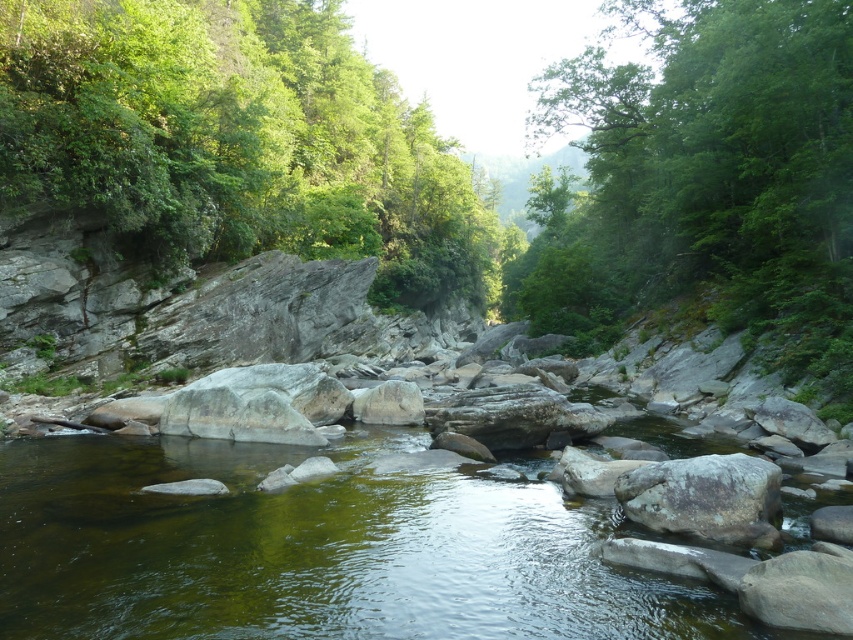
Question: Considering the real-world distances, which object is farthest from the green leafy tree at upper left?

Choices:
 (A) gray rough rock at center
 (B) green leafy tree at upper center

Answer: (A)

Question: Estimate the real-world distances between objects in this image. Which object is farther from the green leafy tree at upper left?

Choices:
 (A) green leafy tree at upper center
 (B) gray rough rock at center

Answer: (B)

Question: From the image, what is the correct spatial relationship of green leafy tree at upper left in relation to green leafy tree at upper center?

Choices:
 (A) left
 (B) right

Answer: (A)

Question: Which object appears closest to the camera in this image?

Choices:
 (A) green leafy tree at upper left
 (B) green leafy tree at upper center

Answer: (B)

Question: Does green leafy tree at upper left have a larger size compared to green leafy tree at upper center?

Choices:
 (A) no
 (B) yes

Answer: (A)

Question: Does green leafy tree at upper left appear on the right side of green leafy tree at upper center?

Choices:
 (A) yes
 (B) no

Answer: (B)